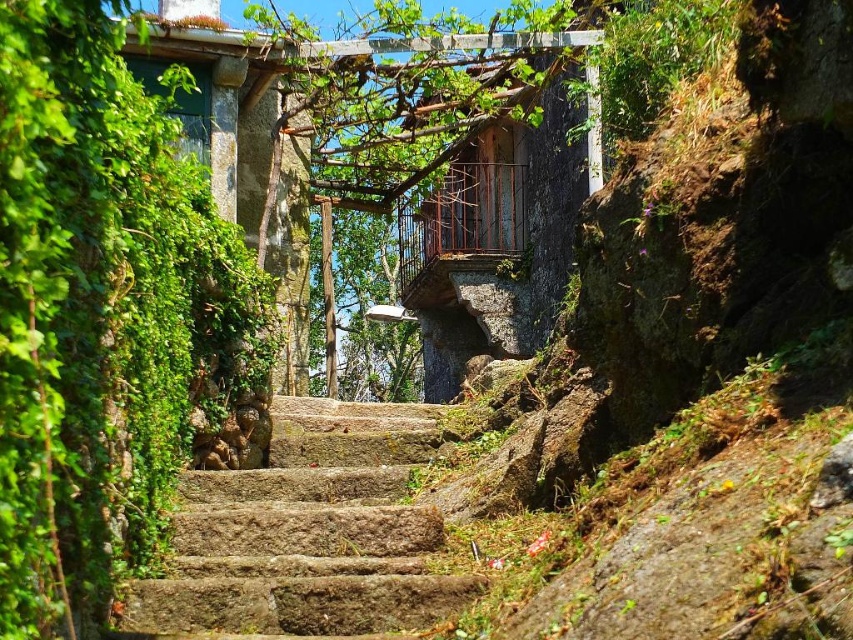
Question: Is green leafy ivy at left bigger than rusty stone stairs at center?

Choices:
 (A) no
 (B) yes

Answer: (B)

Question: Which object appears farthest from the camera in this image?

Choices:
 (A) green leafy ivy at left
 (B) rusty stone stairs at center

Answer: (B)

Question: Can you confirm if green leafy ivy at left is thinner than rusty stone stairs at center?

Choices:
 (A) no
 (B) yes

Answer: (B)

Question: Does green leafy ivy at left appear on the left side of rusty stone stairs at center?

Choices:
 (A) no
 (B) yes

Answer: (B)